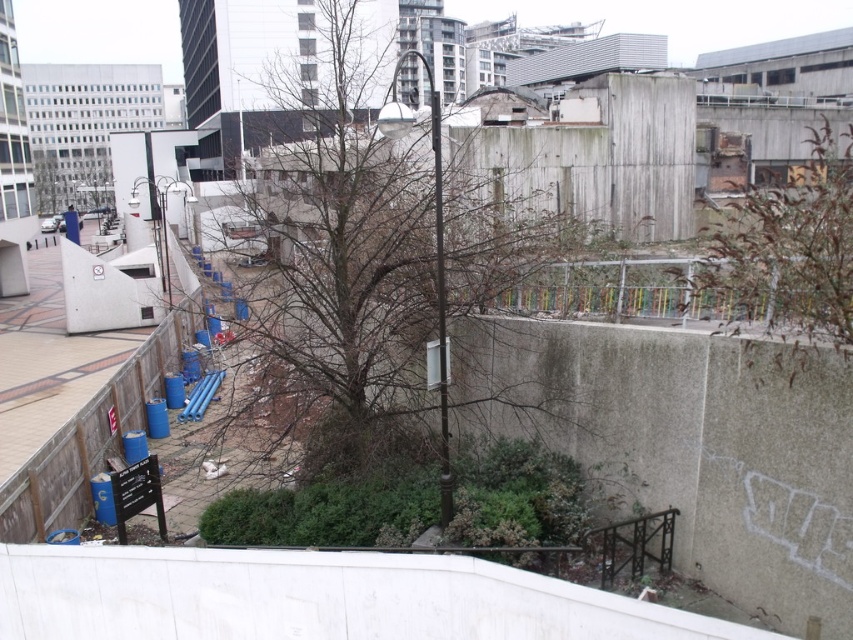
Does point (712, 248) come behind point (38, 161)?

No, it is not.

Which of these two, brown textured tree at upper right or green leafy tree at upper left, stands taller?

green leafy tree at upper left

Is point (848, 192) positioned before point (54, 184)?

Yes, it is.

Where is `brown textured tree at upper right`? This screenshot has width=853, height=640. brown textured tree at upper right is located at coordinates (787, 257).

Can you confirm if bare branches at center is smaller than green leafy tree at upper left?

Actually, bare branches at center might be larger than green leafy tree at upper left.

Who is more forward, (354, 225) or (47, 205)?

Point (354, 225)

Identify the location of bare branches at center. Image resolution: width=853 pixels, height=640 pixels. (370, 250).

Which is in front, point (410, 4) or point (755, 307)?

Positioned in front is point (755, 307).

Is bare branches at center positioned before brown textured tree at upper right?

No, it is not.

At what (x,y) coordinates should I click in order to perform the action: click on bare branches at center. Please return your answer as a coordinate pair (x, y). The image size is (853, 640). Looking at the image, I should click on (370, 250).

You are a GUI agent. You are given a task and a screenshot of the screen. Output one action in this format:
    pyautogui.click(x=<x>, y=<y>)
    Task: Click on the bare branches at center
    Image resolution: width=853 pixels, height=640 pixels.
    Given the screenshot: What is the action you would take?
    pyautogui.click(x=370, y=250)